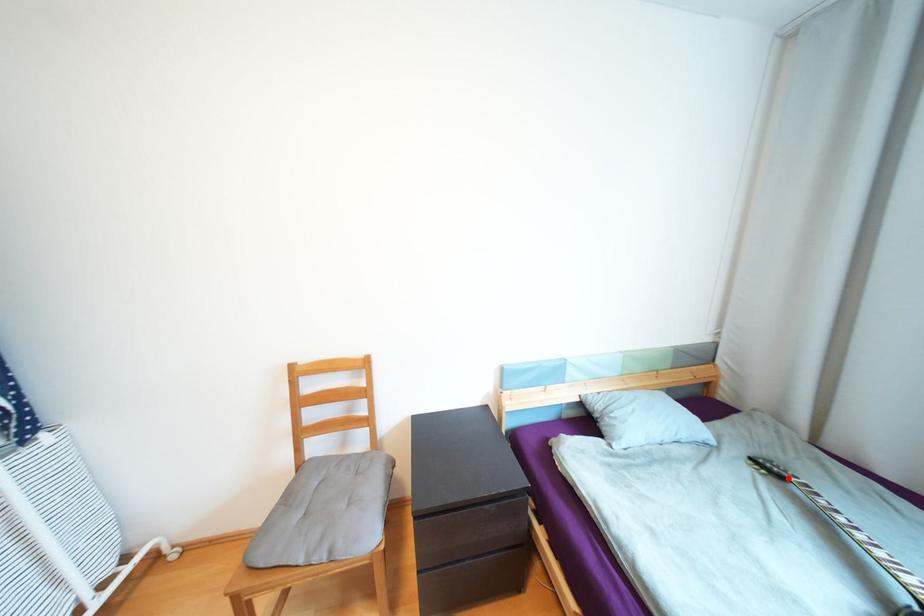
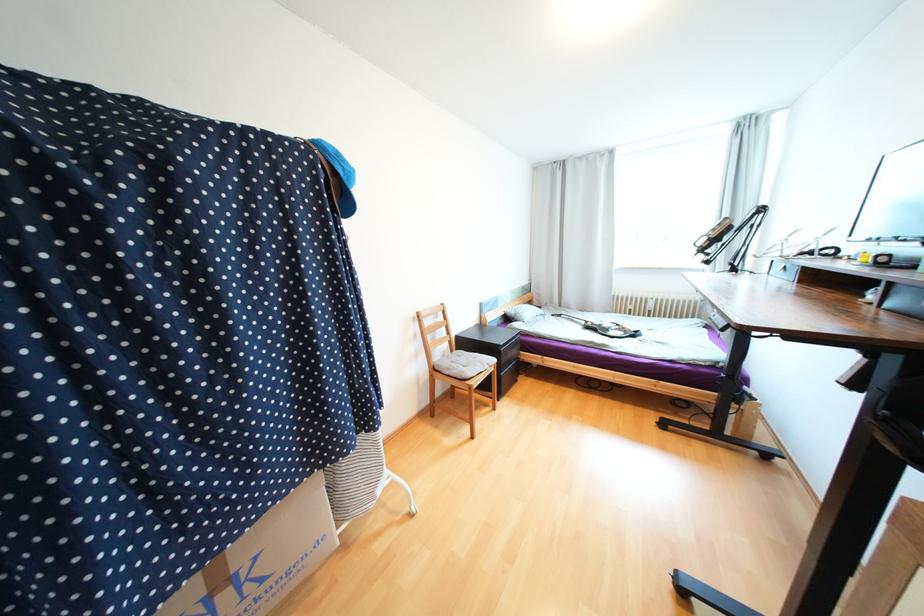
Find the pixel in the second image that matches the highlighted location in the first image.

(565, 315)